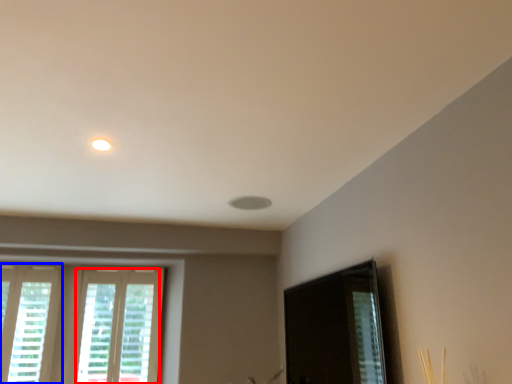
Question: Which of the following is the closest to the observer, window (highlighted by a red box) or window (highlighted by a blue box)?

Choices:
 (A) window
 (B) window

Answer: (B)